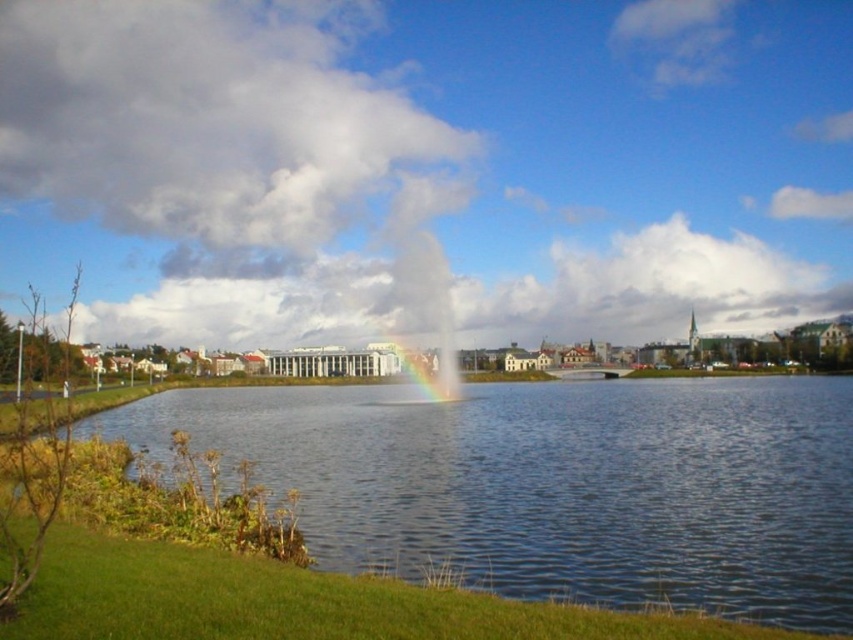
Can you confirm if clear water at center is positioned below cloudy sky at upper center?

Result: Yes.

Measure the distance from clear water at center to cloudy sky at upper center.

clear water at center is 167.33 meters away from cloudy sky at upper center.

Does point (561, 547) come closer to viewer compared to point (303, 48)?

Yes, it is in front of point (303, 48).

At what (x,y) coordinates should I click in order to perform the action: click on clear water at center. Please return your answer as a coordinate pair (x, y). The height and width of the screenshot is (640, 853). Looking at the image, I should click on (561, 483).